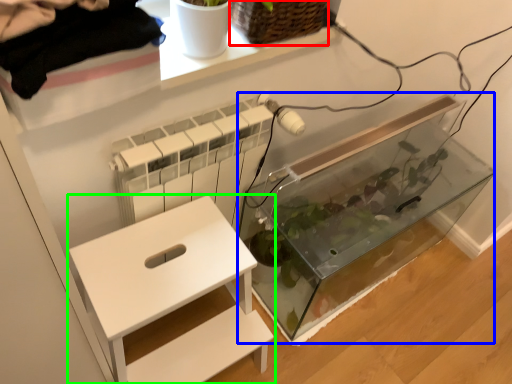
Question: Which object is positioned closest to basket (highlighted by a red box)? Select from glass box (highlighted by a blue box) and furniture (highlighted by a green box).

Choices:
 (A) glass box
 (B) furniture

Answer: (B)